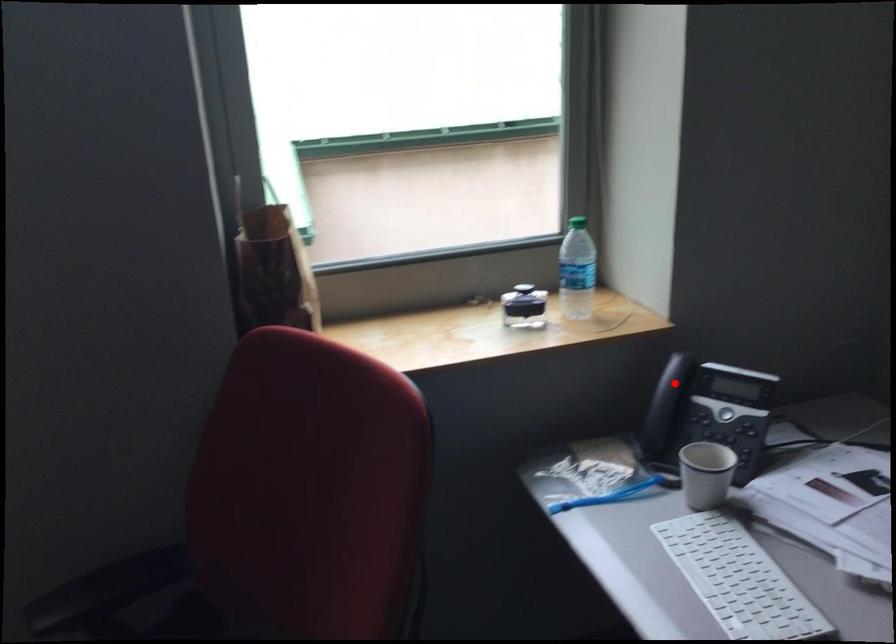
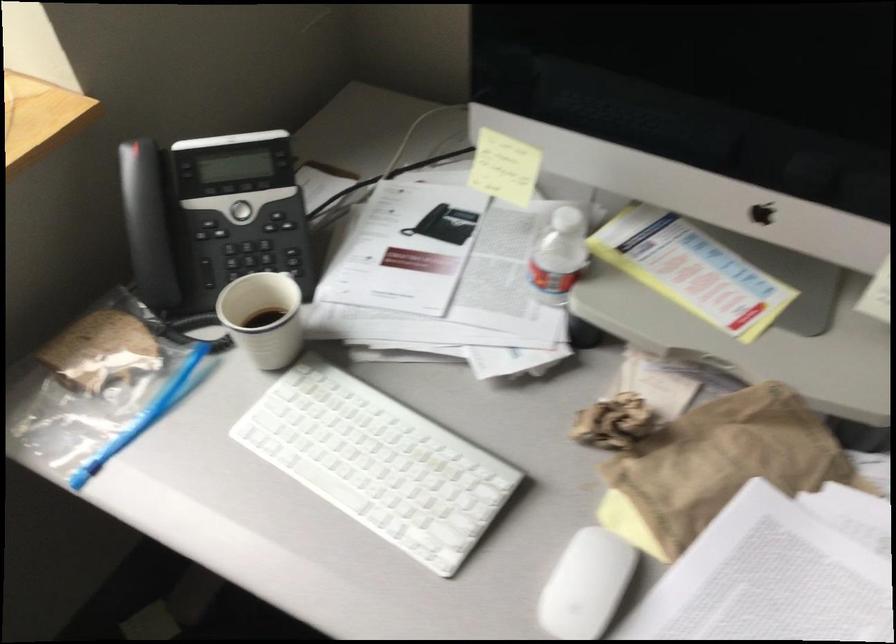
In the second image, find the point that corresponds to the highlighted location in the first image.

(142, 203)